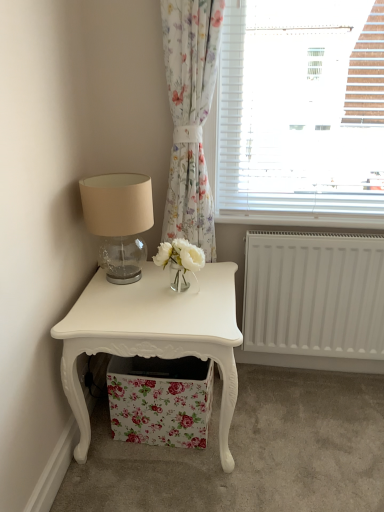
Question: Considering the relative sizes of matte glass table lamp at upper left and white glossy nightstand at lower left in the image provided, is matte glass table lamp at upper left smaller than white glossy nightstand at lower left?

Choices:
 (A) no
 (B) yes

Answer: (B)

Question: From a real-world perspective, is matte glass table lamp at upper left located beneath white glossy nightstand at lower left?

Choices:
 (A) yes
 (B) no

Answer: (B)

Question: Is the depth of matte glass table lamp at upper left greater than that of white glossy nightstand at lower left?

Choices:
 (A) no
 (B) yes

Answer: (B)

Question: Is matte glass table lamp at upper left closer to camera compared to white glossy nightstand at lower left?

Choices:
 (A) yes
 (B) no

Answer: (B)

Question: Does matte glass table lamp at upper left contain white glossy nightstand at lower left?

Choices:
 (A) no
 (B) yes

Answer: (A)

Question: Is matte glass table lamp at upper left wider than white glossy nightstand at lower left?

Choices:
 (A) yes
 (B) no

Answer: (B)

Question: Can we say matte glass table lamp at upper left lies outside floral fabric storage box at lower center?

Choices:
 (A) yes
 (B) no

Answer: (A)

Question: From the image's perspective, is matte glass table lamp at upper left on floral fabric storage box at lower center?

Choices:
 (A) no
 (B) yes

Answer: (B)

Question: From the image's perspective, is matte glass table lamp at upper left located beneath floral fabric storage box at lower center?

Choices:
 (A) yes
 (B) no

Answer: (B)

Question: Considering the relative sizes of matte glass table lamp at upper left and floral fabric storage box at lower center in the image provided, is matte glass table lamp at upper left taller than floral fabric storage box at lower center?

Choices:
 (A) yes
 (B) no

Answer: (A)

Question: Is matte glass table lamp at upper left further to camera compared to floral fabric storage box at lower center?

Choices:
 (A) yes
 (B) no

Answer: (B)

Question: Could floral fabric storage box at lower center be considered to be inside matte glass table lamp at upper left?

Choices:
 (A) no
 (B) yes

Answer: (A)

Question: Is floral fabric storage box at lower center located outside floral fabric curtain at upper center?

Choices:
 (A) no
 (B) yes

Answer: (B)